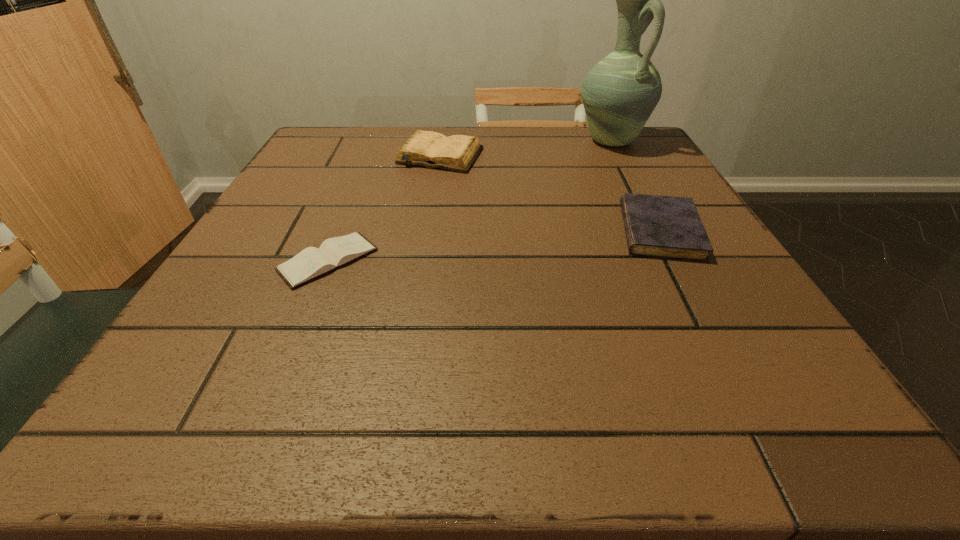
This screenshot has width=960, height=540. In the image, there is a desktop. Identify the location of vacant space at the far left corner. (312, 136).

In the image, there is a desktop. At what (x,y) coordinates should I click in order to perform the action: click on vacant space at the near left corner. Please return your answer as a coordinate pair (x, y). Looking at the image, I should click on (218, 421).

The image size is (960, 540). What are the coordinates of `vacant space at the far right corner` in the screenshot? It's located at (640, 150).

Where is `free space between the tallest object and the third tallest object`? free space between the tallest object and the third tallest object is located at coordinates (636, 186).

Locate an element on the screen. vacant space in between the tallest object and the second shortest diary is located at coordinates (636, 186).

Find the location of a particular element. The width and height of the screenshot is (960, 540). free area in between the second tallest diary and the tallest object is located at coordinates (636, 186).

The width and height of the screenshot is (960, 540). In order to click on free area in between the pitcher and the farthest diary in this screenshot , I will do `click(526, 148)`.

You are a GUI agent. You are given a task and a screenshot of the screen. Output one action in this format:
    pyautogui.click(x=<x>, y=<y>)
    Task: Click on the empty location between the second tallest object and the shortest object
    
    Given the screenshot: What is the action you would take?
    pyautogui.click(x=384, y=208)

Identify the location of vacant space that is in between the rightmost diary and the pitcher. (636, 186).

I want to click on free space between the pitcher and the farthest diary, so click(x=526, y=148).